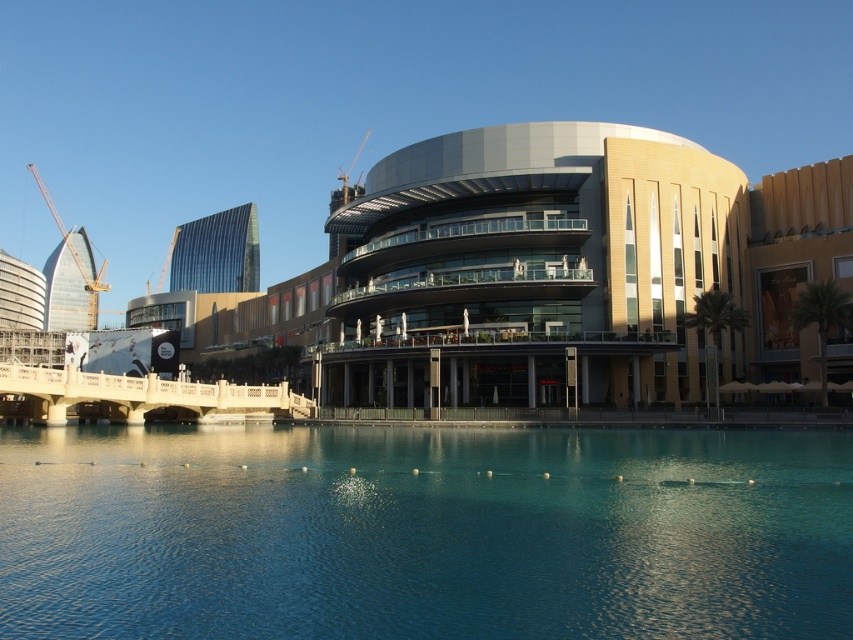
Does clear blue water at center appear on the right side of matte glass building at center?

Indeed, clear blue water at center is positioned on the right side of matte glass building at center.

Which of these two, clear blue water at center or matte glass building at center, stands taller?

Standing taller between the two is matte glass building at center.

Locate an element on the screen. Image resolution: width=853 pixels, height=640 pixels. clear blue water at center is located at coordinates (422, 532).

In the scene shown: Is matte glass building at center closer to the viewer compared to yellow construction crane at left?

Yes, it is in front of yellow construction crane at left.

Consider the image. Is matte glass building at center taller than yellow construction crane at left?

No, matte glass building at center is not taller than yellow construction crane at left.

Locate an element on the screen. matte glass building at center is located at coordinates coord(547,276).

Is point (767, 582) closer to viewer compared to point (57, 225)?

Yes, it is.

Which is in front, point (415, 605) or point (93, 307)?

Point (415, 605)

At what (x,y) coordinates should I click in order to perform the action: click on clear blue water at center. Please return your answer as a coordinate pair (x, y). This screenshot has width=853, height=640. Looking at the image, I should click on (422, 532).